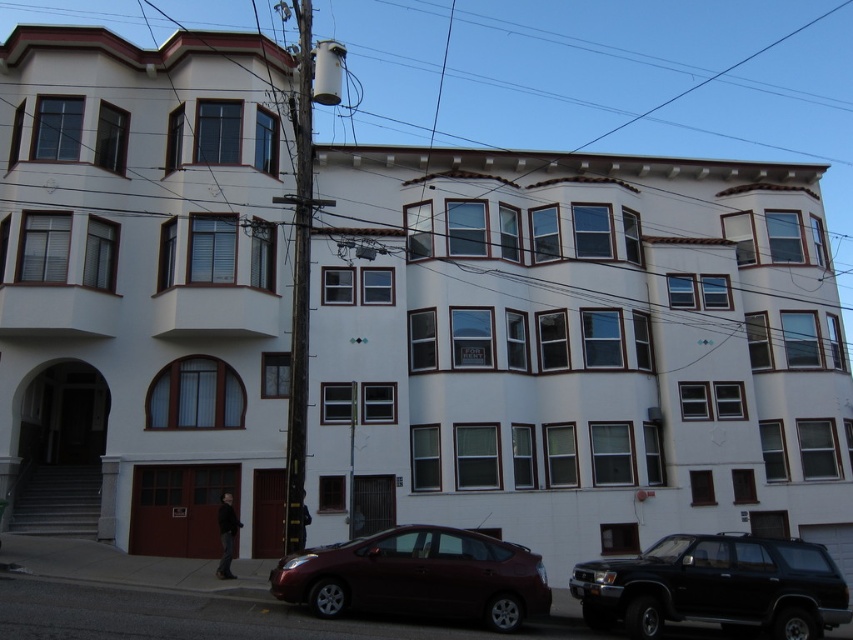
You are a delivery person trying to park your vehicle in the driveway of the building. You see the black matte suv at lower right and the shiny maroon sedan at lower center. Which vehicle is blocking your path to the entrance?

The black matte suv at lower right is positioned over the shiny maroon sedan at lower center, meaning the suv is blocking the path to the entrance.

You are standing at the entrance of the building and want to park your car, which is the same size as the black matte suv at lower right. The parking space available is 15 meters long. Can you safely park your car there?

The black matte suv at lower right is 45.71 feet from camera. Since 45.71 feet is approximately 13.93 meters, which is shorter than the 15 meters available parking space, you can safely park your car there.

You are a delivery person driving a 2.5 meter wide truck and need to park between the black matte suv at lower right and the shiny maroon sedan at lower center. Is there enough space for your truck to fit between them?

The distance between the black matte suv at lower right and the shiny maroon sedan at lower center is 5.93 meters. Since your truck is 2.5 meters wide, there is sufficient space to park between them as the available space is wider than the truck.